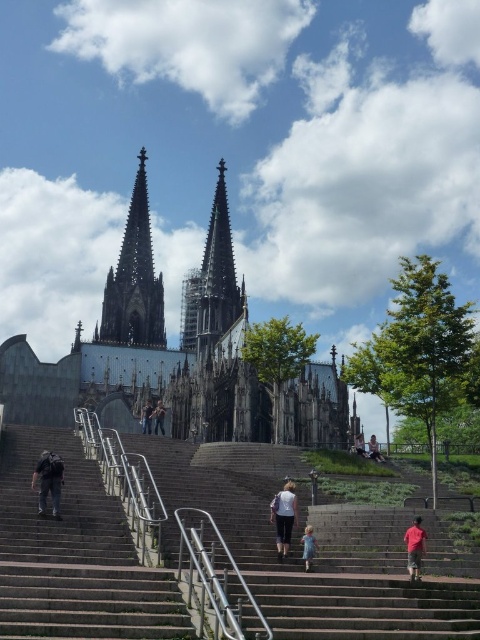
You are standing at the bottom of the cathedral steps and see the dark gray stone spire at center and the blue denim dress at center. Which object is positioned to the left when viewed from your perspective?

The dark gray stone spire at center is positioned to the left of the blue denim dress at center.

You are a photographer planning to capture a symmetrical shot of the cathedral steps. You notice two people wearing a white cotton pants at center and a blue denim dress at center. Which clothing item would you suggest the person adjust to ensure symmetry in the photo?

The white cotton pants at center has a larger width than the blue denim dress at center, so adjusting the white cotton pants at center to be more centered or narrower might help achieve symmetry.

You are standing at the bottom of the cathedral steps and want to take a photo that includes both point (x=240, y=288) and point (x=315, y=547). Which point will appear closer to the edge of the photo frame?

Point (x=315, y=547) will appear closer to the edge of the photo frame because it is farther from the camera compared to point (x=240, y=288), which is closer.